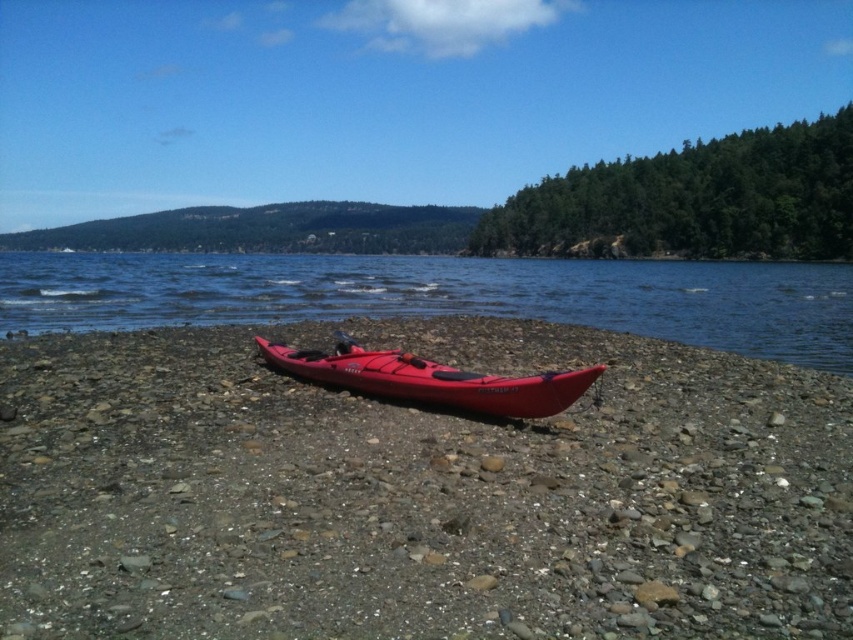
Question: Which point is closer to the camera?

Choices:
 (A) (619, 577)
 (B) (32, 324)

Answer: (A)

Question: Can you confirm if matte plastic kayak at center is bigger than matte red canoe at center?

Choices:
 (A) yes
 (B) no

Answer: (A)

Question: Is matte plastic kayak at center bigger than transparent water at center?

Choices:
 (A) yes
 (B) no

Answer: (B)

Question: Can you confirm if matte plastic kayak at center is positioned below transparent water at center?

Choices:
 (A) no
 (B) yes

Answer: (B)

Question: Among these objects, which one is nearest to the camera?

Choices:
 (A) matte plastic kayak at center
 (B) matte red canoe at center

Answer: (A)

Question: Which object is farther from the camera taking this photo?

Choices:
 (A) matte red canoe at center
 (B) matte plastic kayak at center
 (C) transparent water at center

Answer: (C)